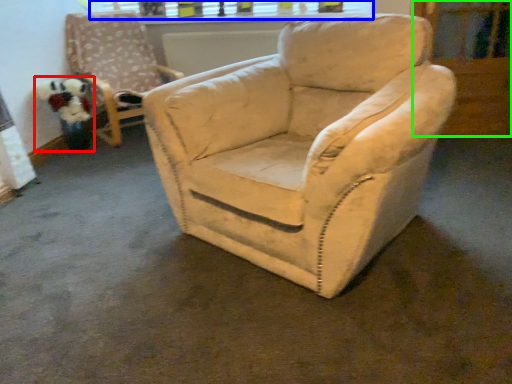
Question: Which is nearer to the toy (highlighted by a red box)? window frame (highlighted by a blue box) or screen door (highlighted by a green box).

Choices:
 (A) window frame
 (B) screen door

Answer: (A)